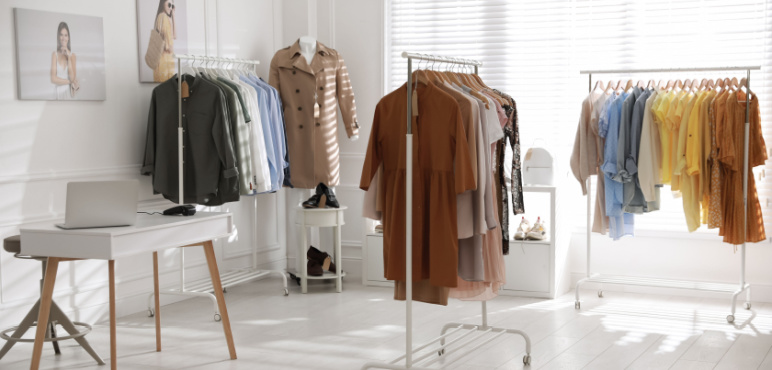
Find the location of a particular element. The image size is (772, 370). wheels on clothing racks is located at coordinates tap(444, 351), tap(526, 358), tap(581, 303), tap(605, 294), tap(737, 324), tap(750, 310).